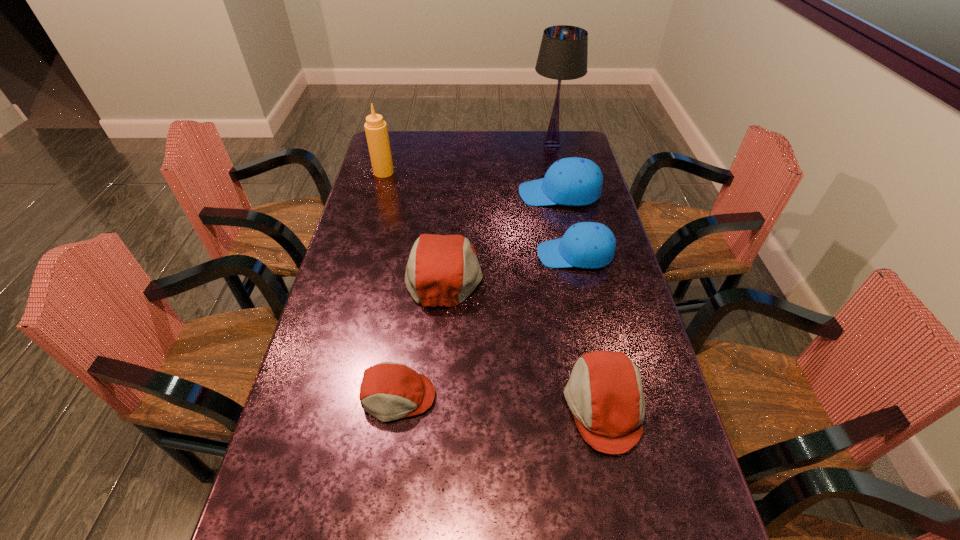
In order to click on lampshade in this screenshot , I will do `click(563, 53)`.

Identify the location of the farthest object. The height and width of the screenshot is (540, 960). (563, 53).

Find the location of a particular element. the leftmost object is located at coordinates (376, 131).

Where is `tan condiment`? The image size is (960, 540). tan condiment is located at coordinates (376, 131).

Find the location of `the bigger blue cap`. the bigger blue cap is located at coordinates (573, 181).

This screenshot has width=960, height=540. I want to click on the farthest cap, so click(573, 181).

Identify the location of the farthest red cap. tap(443, 270).

Locate an element on the screen. This screenshot has width=960, height=540. the nearer blue cap is located at coordinates (588, 245).

At what (x,y) coordinates should I click in order to perform the action: click on the second smallest red cap. Please return your answer as a coordinate pair (x, y). The image size is (960, 540). Looking at the image, I should click on (604, 392).

The height and width of the screenshot is (540, 960). Find the location of `the smallest red cap`. the smallest red cap is located at coordinates (389, 391).